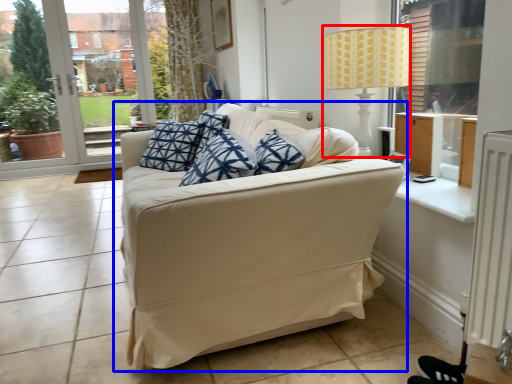
Question: Among these objects, which one is nearest to the camera, table lamp (highlighted by a red box) or studio couch (highlighted by a blue box)?

Choices:
 (A) table lamp
 (B) studio couch

Answer: (B)